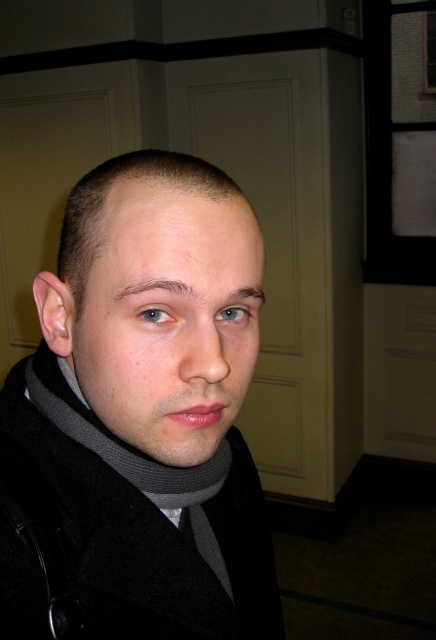
Question: Which of the following is the closest to the observer?

Choices:
 (A) black woolen coat at center
 (B) gray wool scarf at center

Answer: (A)

Question: Is black woolen coat at center closer to camera compared to gray wool scarf at center?

Choices:
 (A) no
 (B) yes

Answer: (B)

Question: Does black woolen coat at center appear over matte gray scarf at center?

Choices:
 (A) yes
 (B) no

Answer: (B)

Question: Which point appears closest to the camera in this image?

Choices:
 (A) (68, 404)
 (B) (180, 385)

Answer: (B)

Question: Which object is closer to the camera taking this photo?

Choices:
 (A) gray wool scarf at center
 (B) matte gray scarf at center

Answer: (B)

Question: Considering the relative positions of black woolen coat at center and matte gray scarf at center in the image provided, where is black woolen coat at center located with respect to matte gray scarf at center?

Choices:
 (A) left
 (B) right

Answer: (B)